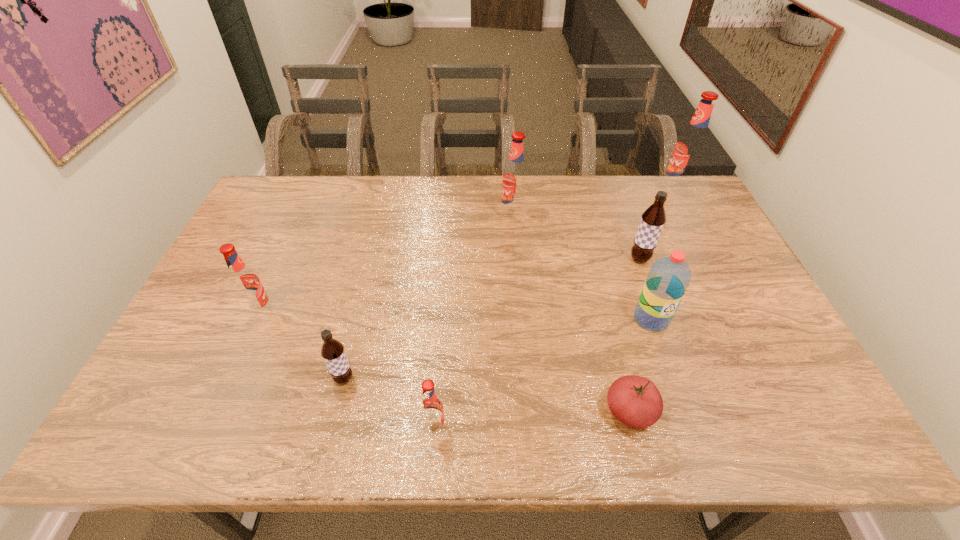
Find the location of `the sixth object from right to left`. the sixth object from right to left is located at coordinates (431, 409).

Identify the location of the nearer brown root beer. Image resolution: width=960 pixels, height=540 pixels. (332, 351).

This screenshot has width=960, height=540. Identify the location of the second nearest root beer. (332, 351).

You are a GUI agent. You are given a task and a screenshot of the screen. Output one action in this format:
    pyautogui.click(x=<x>, y=<y>)
    Task: Click on the fifth object from left to right
    The height and width of the screenshot is (540, 960).
    Given the screenshot: What is the action you would take?
    pyautogui.click(x=635, y=401)

Find the location of `tomato`. tomato is located at coordinates [635, 401].

The width and height of the screenshot is (960, 540). In order to click on vacant space positioned 0.400m on the front of the rightmost object in this screenshot , I will do `click(722, 283)`.

Where is `free space located on the right of the fifth object from right to left`? free space located on the right of the fifth object from right to left is located at coordinates (617, 215).

Locate an element on the screen. free point located 0.260m on the left of the bigger brown root beer is located at coordinates (543, 259).

Where is `blank space located 0.330m on the back of the third farthest red root beer`? blank space located 0.330m on the back of the third farthest red root beer is located at coordinates (300, 227).

I want to click on free space located on the front label of the water bottle, so click(x=665, y=359).